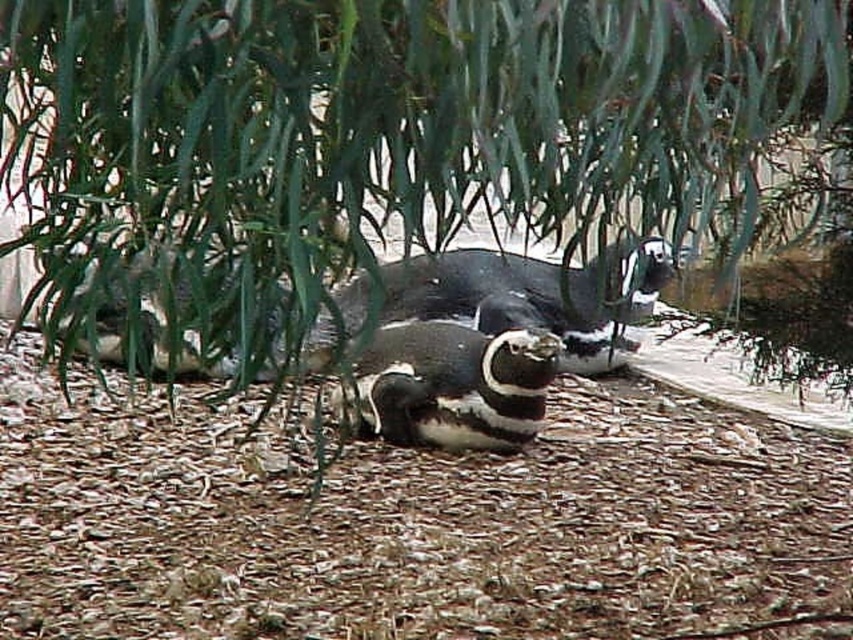
Between green leafy tree at center and black matte penguin at center, which one has less height?

Standing shorter between the two is black matte penguin at center.

Identify the location of green leafy tree at center. (381, 129).

Who is higher up, green leafy tree at center or black and white penguin at center?

green leafy tree at center

In the scene shown: Who is more forward, (236,346) or (514,449)?

Positioned in front is point (236,346).

Find the location of a particular element. green leafy tree at center is located at coordinates (381, 129).

Does black matte penguin at center have a lesser width compared to black and white penguin at center?

In fact, black matte penguin at center might be wider than black and white penguin at center.

Is point (653, 259) more distant than point (395, 324)?

Yes, point (653, 259) is behind point (395, 324).

This screenshot has height=640, width=853. Identify the location of black matte penguin at center. (537, 296).